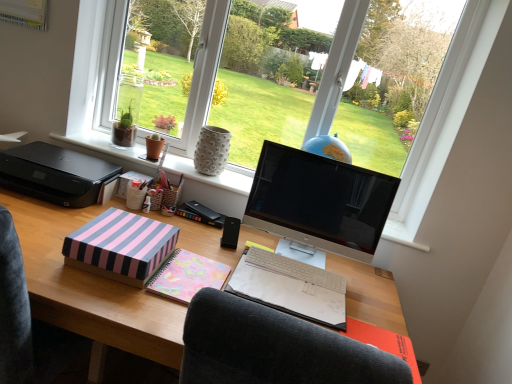
Find the location of `vacant area that is in front of black plastic speaker at center`. vacant area that is in front of black plastic speaker at center is located at coordinates (231, 258).